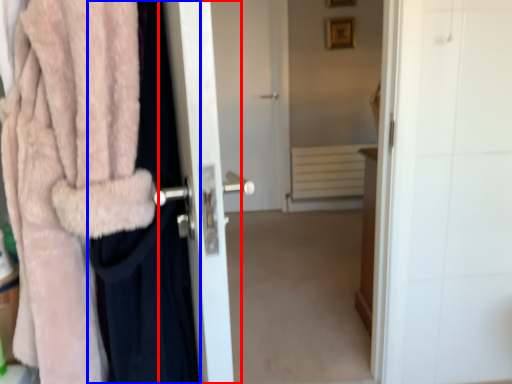
Question: Among these objects, which one is farthest to the camera, screen door (highlighted by a red box) or clothing (highlighted by a blue box)?

Choices:
 (A) screen door
 (B) clothing

Answer: (B)